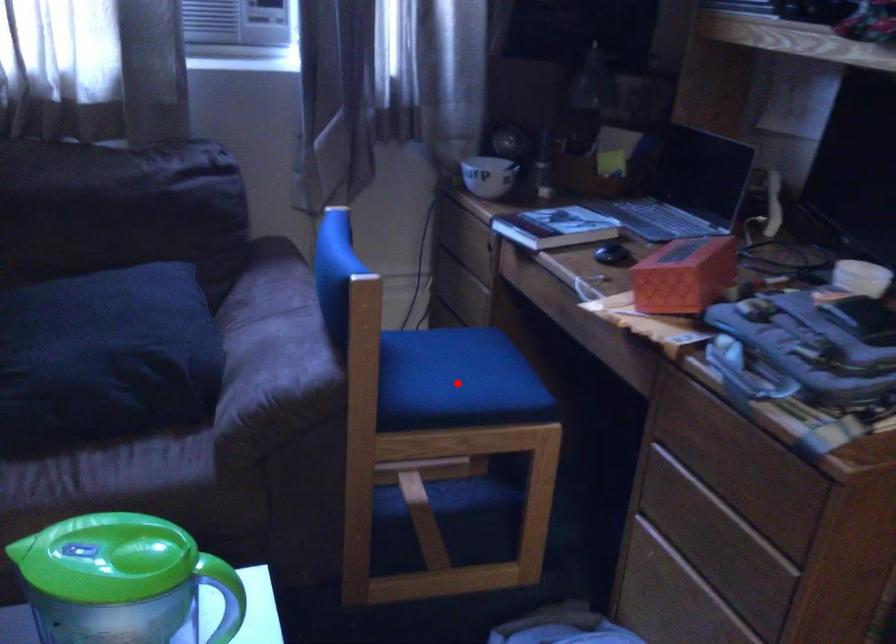
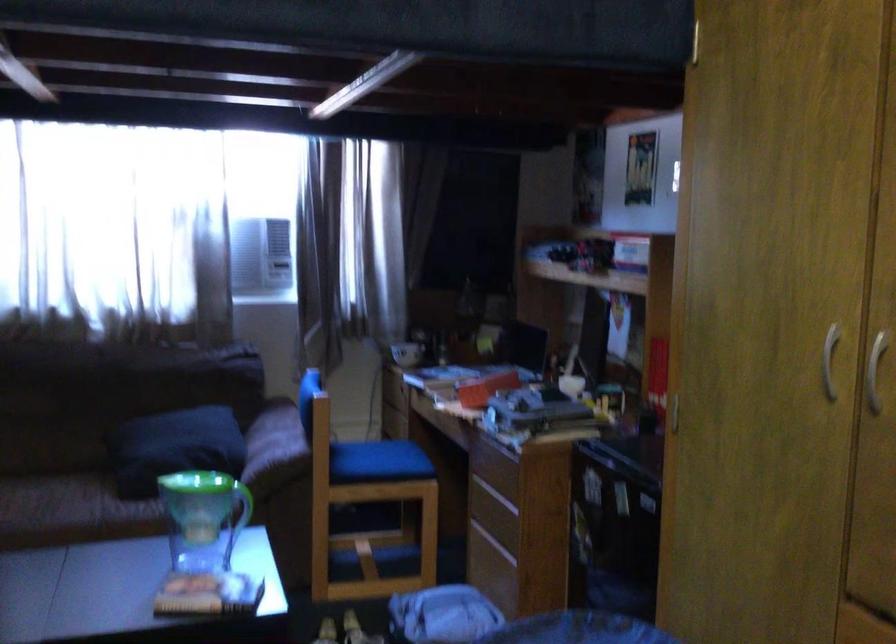
Where in the second image is the point corresponding to the highlighted location from the first image?

(377, 462)